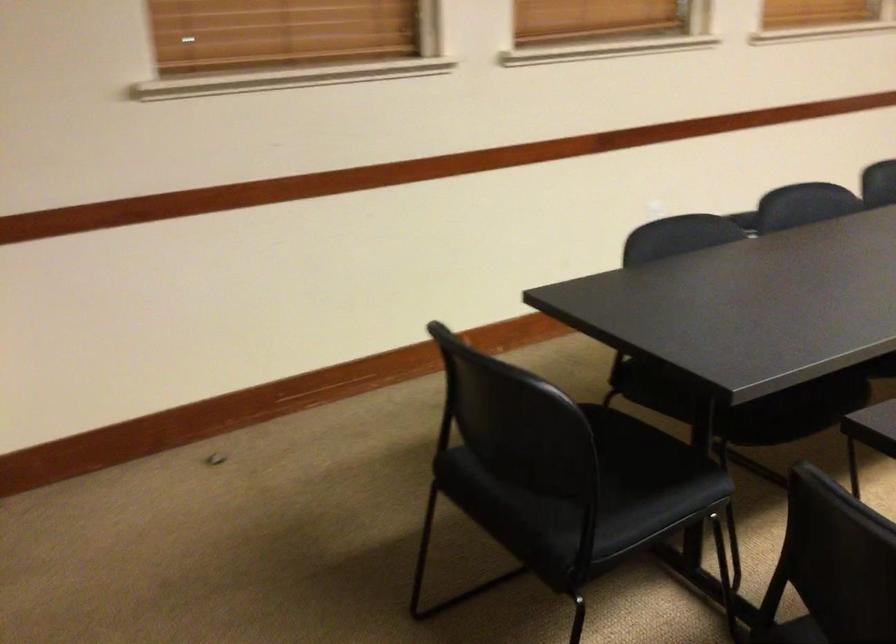
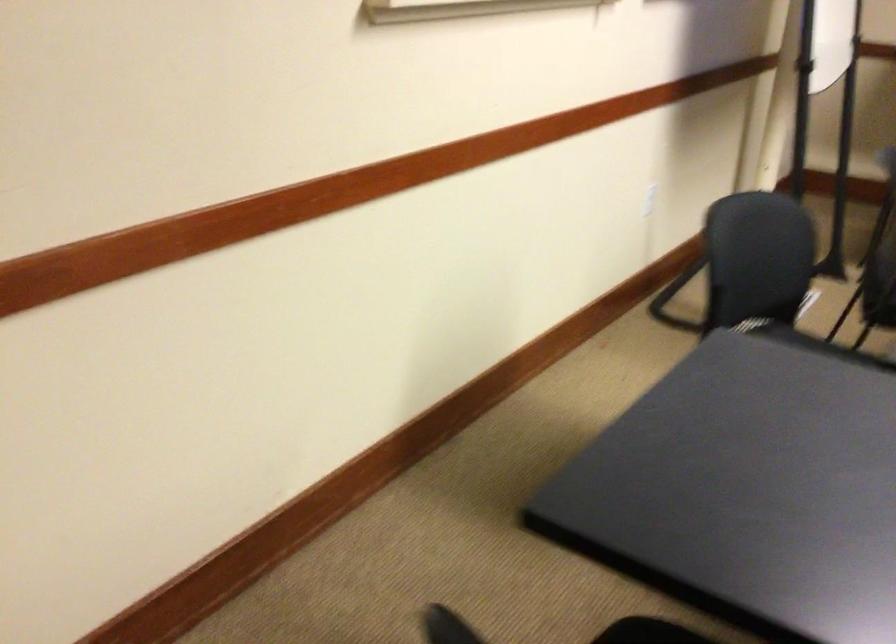
Question: The images are taken continuously from a first-person perspective. In which direction are you moving?

Choices:
 (A) Left
 (B) Right
 (C) Forward
 (D) Backward

Answer: (D)